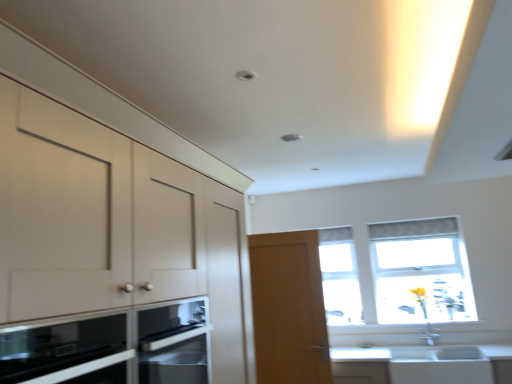
Describe the element at coordinates (340, 276) in the screenshot. I see `clear glass window at center, the second window when ordered from right to left` at that location.

Where is `clear glass window at center, the second window when ordered from right to left`? Image resolution: width=512 pixels, height=384 pixels. clear glass window at center, the second window when ordered from right to left is located at coordinates (340, 276).

Describe the element at coordinates (111, 347) in the screenshot. I see `black glass microwave oven at lower left` at that location.

Where is `clear glass window at center, which ranks as the first window in left-to-right order`? This screenshot has height=384, width=512. clear glass window at center, which ranks as the first window in left-to-right order is located at coordinates (340, 276).

Considering the relative sizes of light brown wooden door at center and black glass microwave oven at lower left in the image provided, is light brown wooden door at center shorter than black glass microwave oven at lower left?

In fact, light brown wooden door at center may be taller than black glass microwave oven at lower left.

Considering the relative sizes of light brown wooden door at center and black glass microwave oven at lower left in the image provided, is light brown wooden door at center bigger than black glass microwave oven at lower left?

Actually, light brown wooden door at center might be smaller than black glass microwave oven at lower left.

From the image's perspective, would you say light brown wooden door at center is positioned over black glass microwave oven at lower left?

No.

From the picture: From a real-world perspective, is light brown wooden door at center physically below black glass microwave oven at lower left?

No, from a real-world perspective, light brown wooden door at center is not beneath black glass microwave oven at lower left.

Considering the sizes of transparent glass window at upper right, marked as the 2th window in a left-to-right arrangement, and white glossy sink at lower right in the image, is transparent glass window at upper right, marked as the 2th window in a left-to-right arrangement, wider or thinner than white glossy sink at lower right?

Clearly, transparent glass window at upper right, marked as the 2th window in a left-to-right arrangement, has less width compared to white glossy sink at lower right.

From the image's perspective, is transparent glass window at upper right, marked as the 2th window in a left-to-right arrangement, on white glossy sink at lower right?

Yes, from the image's perspective, transparent glass window at upper right, marked as the 2th window in a left-to-right arrangement, is on top of white glossy sink at lower right.

What are the coordinates of `the 1st window behind the white glossy sink at lower right` in the screenshot? It's located at (420, 270).

Considering the points (407, 285) and (84, 88), which point is behind, point (407, 285) or point (84, 88)?

Point (407, 285)

Who is taller, transparent glass window at upper right, the 1th window when ordered from right to left, or matte white cabinets at left?

With more height is matte white cabinets at left.

Can you confirm if transparent glass window at upper right, marked as the 2th window in a left-to-right arrangement, is bigger than matte white cabinets at left?

No, transparent glass window at upper right, marked as the 2th window in a left-to-right arrangement, is not bigger than matte white cabinets at left.

Is clear glass window at center, which ranks as the first window in left-to-right order, aimed at black glass microwave oven at lower left?

Yes, clear glass window at center, which ranks as the first window in left-to-right order, is oriented towards black glass microwave oven at lower left.

Considering the positions of objects clear glass window at center, which ranks as the first window in left-to-right order, and black glass microwave oven at lower left in the image provided, who is in front, clear glass window at center, which ranks as the first window in left-to-right order, or black glass microwave oven at lower left?

black glass microwave oven at lower left.

Can you tell me how much clear glass window at center, the second window when ordered from right to left, and black glass microwave oven at lower left differ in facing direction?

The facing directions of clear glass window at center, the second window when ordered from right to left, and black glass microwave oven at lower left are 91.5 degrees apart.

From a real-world perspective, is clear glass window at center, which ranks as the first window in left-to-right order, above or below black glass microwave oven at lower left?

clear glass window at center, which ranks as the first window in left-to-right order, is situated higher than black glass microwave oven at lower left in the real world.

Is matte white cabinets at left outside of white glossy sink at lower right?

Yes, matte white cabinets at left is not within white glossy sink at lower right.

Which is more to the right, matte white cabinets at left or white glossy sink at lower right?

From the viewer's perspective, white glossy sink at lower right appears more on the right side.

Can you confirm if matte white cabinets at left is bigger than white glossy sink at lower right?

Indeed, matte white cabinets at left has a larger size compared to white glossy sink at lower right.

In the scene shown: Which object is further away from the camera taking this photo, matte white cabinets at left or white glossy sink at lower right?

white glossy sink at lower right is more distant.

Where is `cabinetry on the left of light brown wooden door at center`? Image resolution: width=512 pixels, height=384 pixels. cabinetry on the left of light brown wooden door at center is located at coordinates (102, 104).

Considering the points (293, 254) and (248, 368), which point is behind, point (293, 254) or point (248, 368)?

The point (293, 254) is farther from the camera.

From a real-world perspective, is light brown wooden door at center on top of matte white cabinets at left?

No, from a real-world perspective, light brown wooden door at center is not over matte white cabinets at left

How different are the orientations of light brown wooden door at center and matte white cabinets at left in degrees?

The angle between the facing direction of light brown wooden door at center and the facing direction of matte white cabinets at left is 88.4 degrees.

Is clear glass window at center, the second window when ordered from right to left, at the back of light brown wooden door at center?

Correct, light brown wooden door at center is looking away from clear glass window at center, the second window when ordered from right to left.

From a real-world perspective, relative to clear glass window at center, the second window when ordered from right to left, is light brown wooden door at center vertically above or below?

Clearly, from a real-world perspective, light brown wooden door at center is below clear glass window at center, the second window when ordered from right to left.

Which object is further away from the camera, light brown wooden door at center or clear glass window at center, the second window when ordered from right to left?

Positioned behind is clear glass window at center, the second window when ordered from right to left.

From the image's perspective, is light brown wooden door at center under clear glass window at center, which ranks as the first window in left-to-right order?

Indeed, from the image's perspective, light brown wooden door at center is shown beneath clear glass window at center, which ranks as the first window in left-to-right order.

You are a GUI agent. You are given a task and a screenshot of the screen. Output one action in this format:
    pyautogui.click(x=<x>, y=<y>)
    Task: Click on the microwave oven on the left side of light brown wooden door at center
    This screenshot has height=384, width=512.
    Given the screenshot: What is the action you would take?
    pyautogui.click(x=111, y=347)

The width and height of the screenshot is (512, 384). Find the location of `window that is the 2nd one when counting upward from the white glossy sink at lower right (from the image's perspective)`. window that is the 2nd one when counting upward from the white glossy sink at lower right (from the image's perspective) is located at coordinates (420, 270).

Estimate the real-world distances between objects in this image. Which object is further from clear glass window at center, which ranks as the first window in left-to-right order, transparent glass window at upper right, the 1th window when ordered from right to left, or white glossy sink at lower right?

Based on the image, white glossy sink at lower right appears to be further to clear glass window at center, which ranks as the first window in left-to-right order.

In the scene shown: Looking at the image, which one is located closer to transparent glass window at upper right, the 1th window when ordered from right to left, black glass microwave oven at lower left or clear glass window at center, which ranks as the first window in left-to-right order?

clear glass window at center, which ranks as the first window in left-to-right order.

Based on their spatial positions, is white glossy sink at lower right or transparent glass window at upper right, marked as the 2th window in a left-to-right arrangement, closer to black glass microwave oven at lower left?

Among the two, white glossy sink at lower right is located nearer to black glass microwave oven at lower left.

Based on the photo, estimate the real-world distances between objects in this image. Which object is further from matte white cabinets at left, clear glass window at center, which ranks as the first window in left-to-right order, or light brown wooden door at center?

The object further to matte white cabinets at left is clear glass window at center, which ranks as the first window in left-to-right order.

Looking at this image, from the image, which object appears to be farther from black glass microwave oven at lower left, matte white cabinets at left or light brown wooden door at center?

light brown wooden door at center is further to black glass microwave oven at lower left.

Estimate the real-world distances between objects in this image. Which object is closer to clear glass window at center, the second window when ordered from right to left, white glossy sink at lower right or light brown wooden door at center?

white glossy sink at lower right is closer to clear glass window at center, the second window when ordered from right to left.

Which object lies further to the anchor point transparent glass window at upper right, marked as the 2th window in a left-to-right arrangement, matte white cabinets at left or white glossy sink at lower right?

matte white cabinets at left lies further to transparent glass window at upper right, marked as the 2th window in a left-to-right arrangement, than the other object.

Looking at this image, estimate the real-world distances between objects in this image. Which object is further from black glass microwave oven at lower left, clear glass window at center, which ranks as the first window in left-to-right order, or light brown wooden door at center?

clear glass window at center, which ranks as the first window in left-to-right order, lies further to black glass microwave oven at lower left than the other object.

Where is `window situated between light brown wooden door at center and transparent glass window at upper right, marked as the 2th window in a left-to-right arrangement, from left to right`? This screenshot has width=512, height=384. window situated between light brown wooden door at center and transparent glass window at upper right, marked as the 2th window in a left-to-right arrangement, from left to right is located at coordinates (340, 276).

In order to click on window positioned between black glass microwave oven at lower left and clear glass window at center, which ranks as the first window in left-to-right order, from near to far in this screenshot , I will do `click(420, 270)`.

Locate an element on the screen. microwave oven between matte white cabinets at left and light brown wooden door at center from front to back is located at coordinates (111, 347).

This screenshot has width=512, height=384. What are the coordinates of `countertop located between matte white cabinets at left and light brown wooden door at center in the depth direction` in the screenshot? It's located at (423, 364).